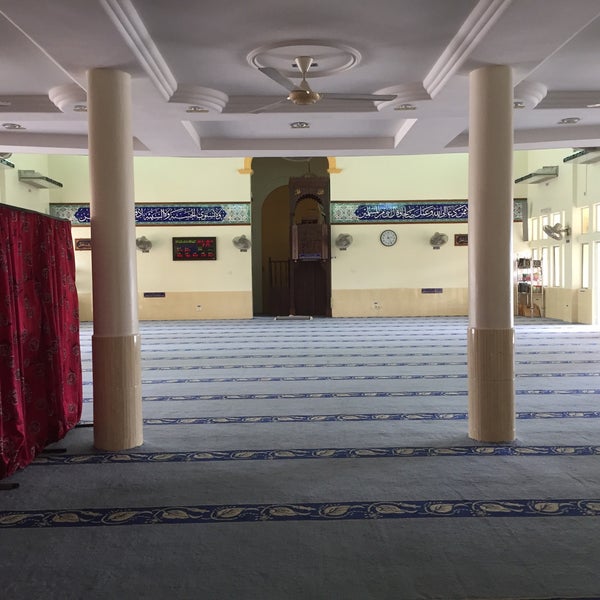
Locate an element on the screen. carpet is located at coordinates (246, 560).